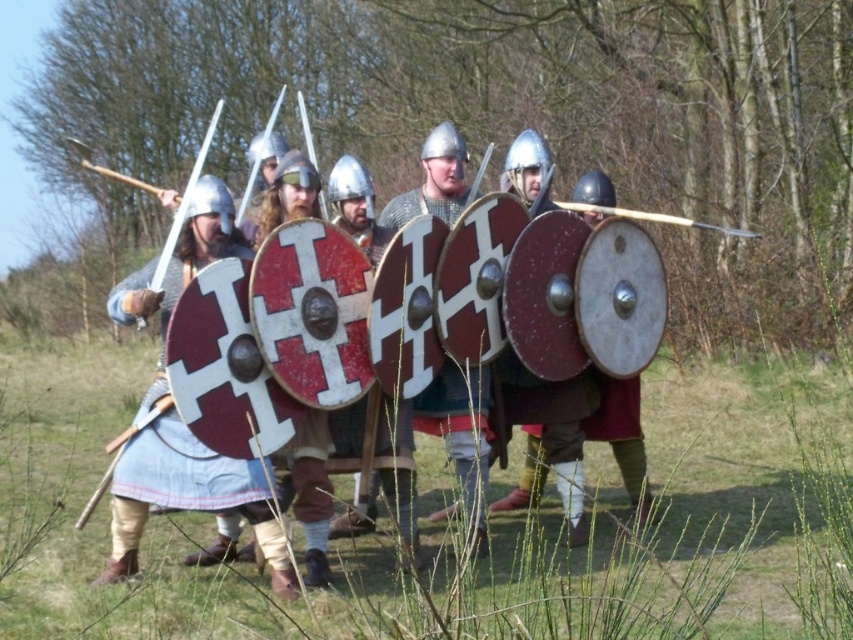
You are a participant in the medieval reenactment and need to retrieve your weapon from the ground. You see a wooden staff at lower left and a wooden spear at center. Which one is closer to your current position at the center of the image?

The wooden spear at center is closer to your current position at the center of the image because it is located at the center, while the wooden staff at lower left is positioned to the left of it.

You are a historian analyzing the image. You need to determine the exact position of the matte silver helmet at center in the image. What are its coordinates?

The matte silver helmet at center is located at coordinates (555, 426).

You are a knight in the medieval reenactment. You notice the matte silver helmet at center and the shiny silver sword at left. Which object is closer to the ground?

The matte silver helmet at center is positioned under the shiny silver sword at left, so the matte silver helmet at center is closer to the ground.